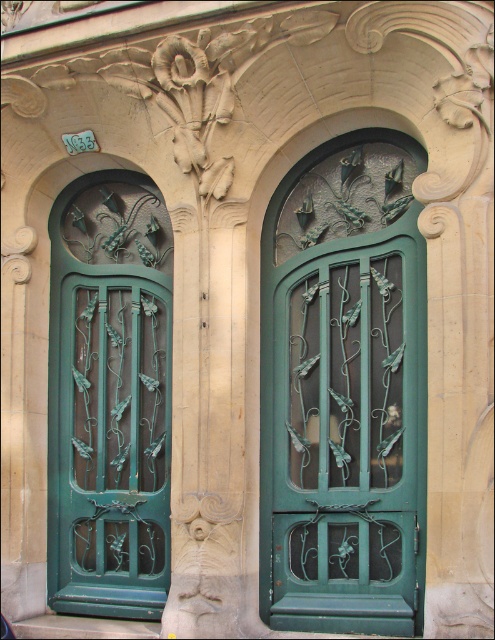
Question: Is green wrought iron door at center below green wrought iron door at left?

Choices:
 (A) no
 (B) yes

Answer: (A)

Question: Is green wrought iron door at center thinner than green wrought iron door at left?

Choices:
 (A) no
 (B) yes

Answer: (A)

Question: Among these points, which one is farthest from the camera?

Choices:
 (A) (385, 483)
 (B) (100, 529)

Answer: (B)

Question: Which point is closer to the camera taking this photo?

Choices:
 (A) (308, 460)
 (B) (56, 413)

Answer: (A)

Question: Is green wrought iron door at center smaller than green wrought iron door at left?

Choices:
 (A) no
 (B) yes

Answer: (A)

Question: Which object is closer to the camera taking this photo?

Choices:
 (A) green wrought iron door at center
 (B) green wrought iron door at left

Answer: (A)